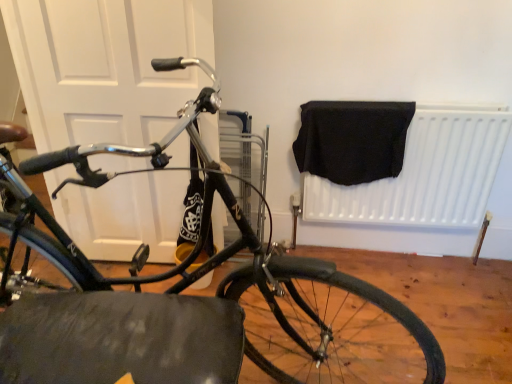
Question: Is black fabric at upper right to the right of white matte door at left from the viewer's perspective?

Choices:
 (A) yes
 (B) no

Answer: (A)

Question: Can you see black fabric at upper right touching white matte door at left?

Choices:
 (A) no
 (B) yes

Answer: (A)

Question: Is black fabric at upper right positioned behind white matte door at left?

Choices:
 (A) yes
 (B) no

Answer: (A)

Question: Is black fabric at upper right closer to camera compared to white matte door at left?

Choices:
 (A) no
 (B) yes

Answer: (A)

Question: Is black fabric at upper right bigger than white matte door at left?

Choices:
 (A) yes
 (B) no

Answer: (B)

Question: Is point (357, 304) closer or farther from the camera than point (385, 120)?

Choices:
 (A) farther
 (B) closer

Answer: (B)

Question: From the image's perspective, relative to black fabric at upper right, is black rubber tire at lower center above or below?

Choices:
 (A) below
 (B) above

Answer: (A)

Question: Is black rubber tire at lower center inside or outside of black fabric at upper right?

Choices:
 (A) outside
 (B) inside

Answer: (A)

Question: In terms of size, does black rubber tire at lower center appear bigger or smaller than black fabric at upper right?

Choices:
 (A) big
 (B) small

Answer: (A)

Question: Considering the positions of shiny black bicycle at center and white matte door at left in the image, is shiny black bicycle at center bigger or smaller than white matte door at left?

Choices:
 (A) small
 (B) big

Answer: (B)

Question: Is point (310, 309) positioned closer to the camera than point (25, 49)?

Choices:
 (A) closer
 (B) farther

Answer: (A)

Question: Is shiny black bicycle at center taller or shorter than white matte door at left?

Choices:
 (A) short
 (B) tall

Answer: (B)

Question: In the image, is shiny black bicycle at center on the left side or the right side of white matte door at left?

Choices:
 (A) right
 (B) left

Answer: (A)

Question: From a real-world perspective, relative to white matte door at left, is black fabric at upper right vertically above or below?

Choices:
 (A) below
 (B) above

Answer: (A)

Question: Which is correct: black fabric at upper right is inside white matte door at left, or outside of it?

Choices:
 (A) outside
 (B) inside

Answer: (A)